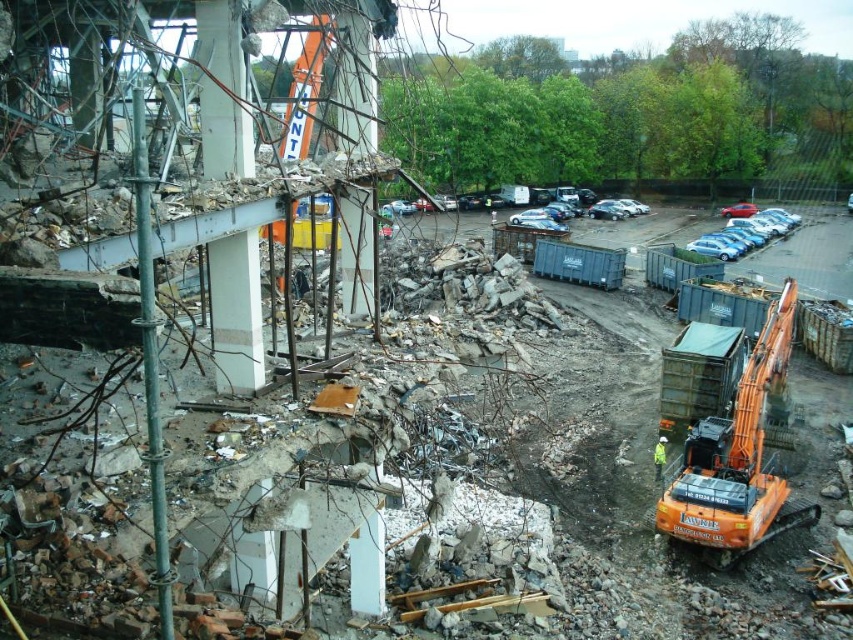
Question: Which object is farther from the camera taking this photo?

Choices:
 (A) orange metallic excavator at lower right
 (B) blue metallic car at right
 (C) concrete pillar at center

Answer: (B)

Question: Which point is farther to the camera?

Choices:
 (A) green reflective safety vest at lower right
 (B) orange metallic excavator at lower right
 (C) concrete pillar at center
 (D) concrete at center

Answer: (A)

Question: Which point appears farthest from the camera in this image?

Choices:
 (A) click(x=706, y=236)
 (B) click(x=361, y=259)
 (C) click(x=225, y=68)
 (D) click(x=656, y=474)

Answer: (A)

Question: Can you confirm if blue metallic car at right is bigger than green reflective safety vest at lower right?

Choices:
 (A) yes
 (B) no

Answer: (A)

Question: Does orange metallic excavator at lower right appear on the right side of concrete at center?

Choices:
 (A) yes
 (B) no

Answer: (A)

Question: Observing the image, what is the correct spatial positioning of orange metallic excavator at lower right in reference to blue metallic car at right?

Choices:
 (A) left
 (B) right

Answer: (A)